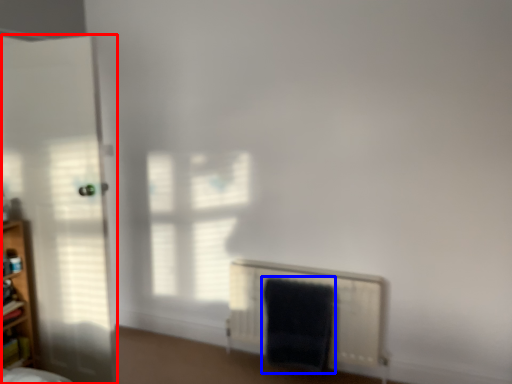
Question: Which of the following is the farthest to the observer, door (highlighted by a red box) or bath towel (highlighted by a blue box)?

Choices:
 (A) door
 (B) bath towel

Answer: (B)